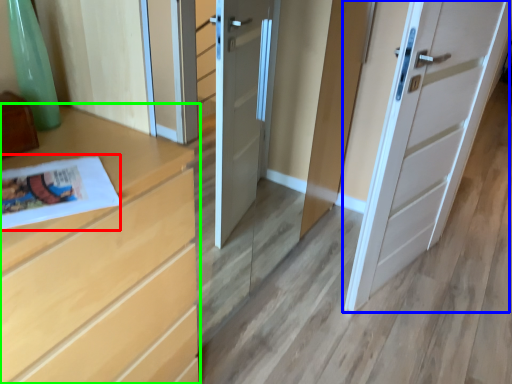
Question: Considering the real-world distances, which object is closest to magazine (highlighted by a red box)? door (highlighted by a blue box) or chest of drawers (highlighted by a green box).

Choices:
 (A) door
 (B) chest of drawers

Answer: (B)